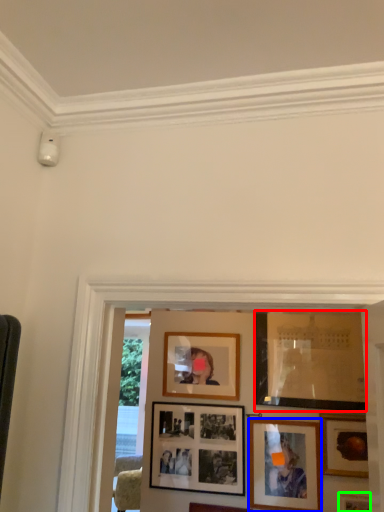
Question: Considering the real-world distances, which object is closest to picture frame (highlighted by a red box)? picture frame (highlighted by a blue box) or picture frame (highlighted by a green box).

Choices:
 (A) picture frame
 (B) picture frame

Answer: (A)